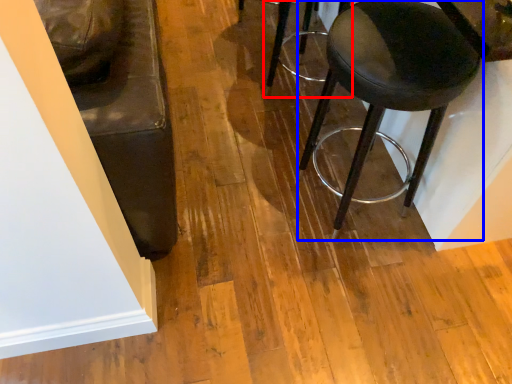
Question: Which object appears farthest to the camera in this image, stool (highlighted by a red box) or stool (highlighted by a blue box)?

Choices:
 (A) stool
 (B) stool

Answer: (A)